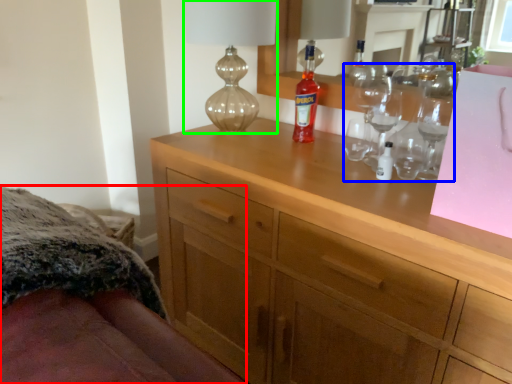
Question: Which object is positioned closest to bed (highlighted by a red box)? Select from wine glass (highlighted by a blue box) and table lamp (highlighted by a green box).

Choices:
 (A) wine glass
 (B) table lamp

Answer: (B)